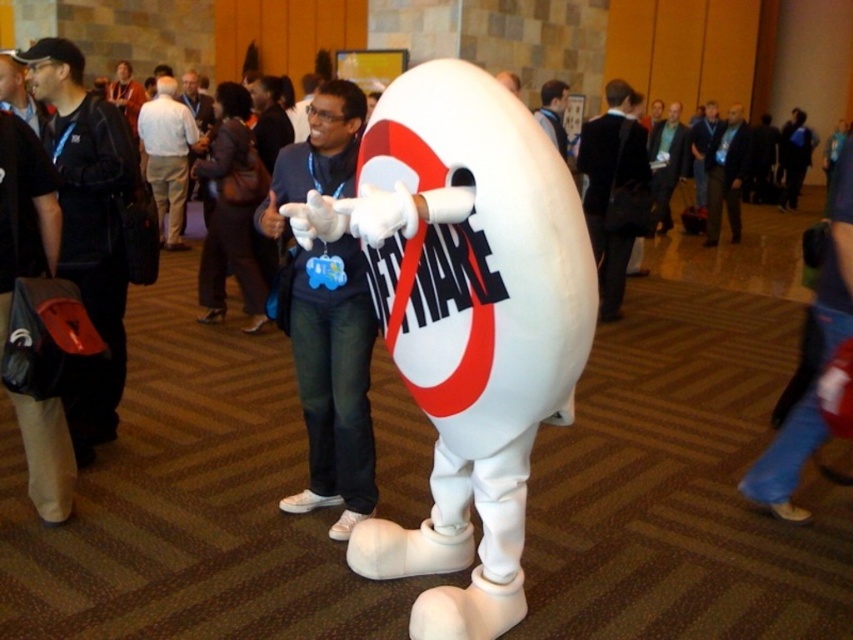
Question: Is dark blue jacket at center in front of green fabric shirt at center?

Choices:
 (A) no
 (B) yes

Answer: (A)

Question: Is black leather jacket at left smaller than dark blue jacket at center?

Choices:
 (A) yes
 (B) no

Answer: (A)

Question: Among these points, which one is nearest to the camera?

Choices:
 (A) (544, 93)
 (B) (695, 125)
 (C) (178, 120)

Answer: (A)

Question: Which point is farther to the camera?

Choices:
 (A) (160, 83)
 (B) (704, 141)
 (C) (619, 189)
 (D) (653, 180)

Answer: (B)

Question: Which of these objects is positioned closest to the white fabric shirt at center?

Choices:
 (A) dark blue jacket at center
 (B) dark blue jeans at center
 (C) matte black jacket at upper center

Answer: (C)

Question: Can you confirm if white foam mascot at center is positioned above white cotton shirt at center?

Choices:
 (A) no
 (B) yes

Answer: (A)